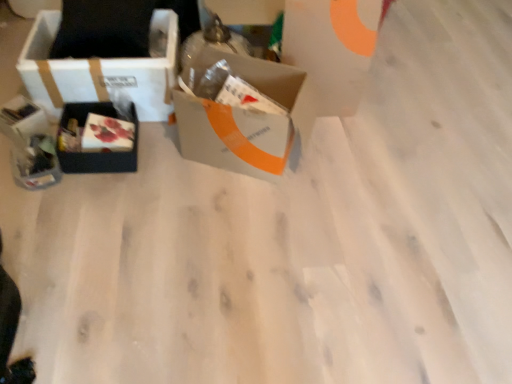
The image size is (512, 384). What are the coordinates of `vacant area that lies to the right of matte black box at left, the second box viewed from the left` in the screenshot? It's located at (164, 159).